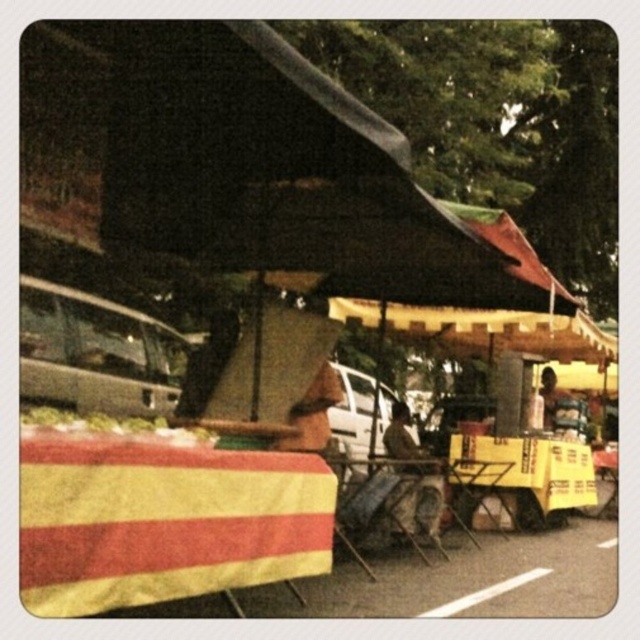
How much distance is there between yellow paper sign at lower right and brown leather jacket at upper right?

yellow paper sign at lower right and brown leather jacket at upper right are 1.12 meters apart.

Between yellow paper sign at lower right and brown leather jacket at upper right, which one appears on the left side from the viewer's perspective?

Positioned to the left is yellow paper sign at lower right.

Where is `yellow paper sign at lower right`? Image resolution: width=640 pixels, height=640 pixels. yellow paper sign at lower right is located at coordinates (525, 474).

Can you confirm if yellow/red striped fabric at center is taller than yellow paper sign at lower right?

No, yellow/red striped fabric at center is not taller than yellow paper sign at lower right.

The image size is (640, 640). What do you see at coordinates (163, 520) in the screenshot?
I see `yellow/red striped fabric at center` at bounding box center [163, 520].

You are a GUI agent. You are given a task and a screenshot of the screen. Output one action in this format:
    pyautogui.click(x=<x>, y=<y>)
    Task: Click on the yellow/red striped fabric at center
    
    Given the screenshot: What is the action you would take?
    pyautogui.click(x=163, y=520)

Who is more distant from viewer, [122,426] or [541,372]?

The point [541,372] is more distant.

The height and width of the screenshot is (640, 640). Identify the location of green leafy vegetables at lower left. click(x=109, y=426).